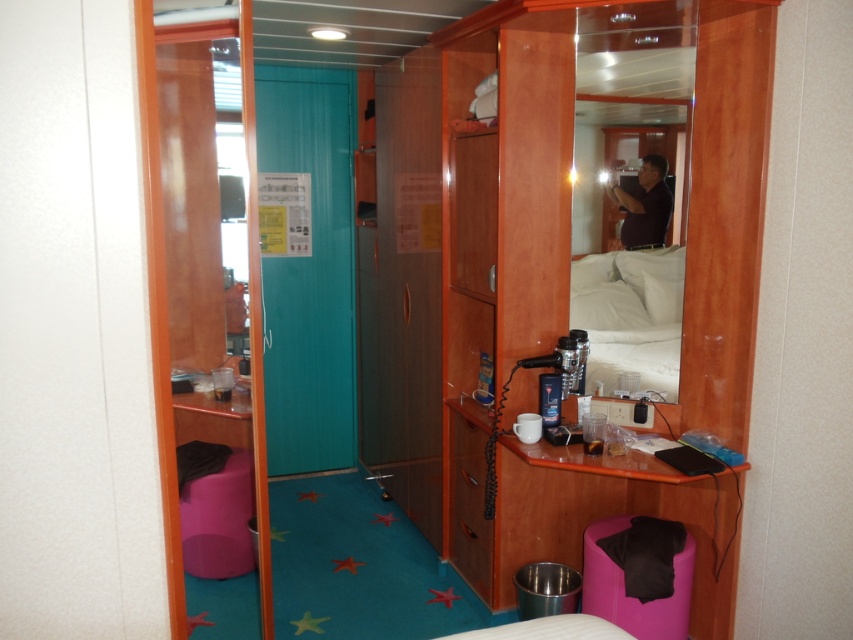
You are a guest in this cruise ship cabin and need to place a rectangular luggage box that is 1.2 meters wide on the floor. The wooden cabinet at center and the white soft bed at center are both in the center of the room. Which object should you place the luggage next to so that it fits without overlapping?

The wooden cabinet at center has a larger width than the white soft bed at center. Since the luggage is 1.2 meters wide, placing it next to the wooden cabinet at center would provide more space to accommodate the luggage without overlapping.

You are standing in the cruise ship cabin and want to reach both the point at coordinates (701, 353) and the point at coordinates (628, 276). Which point will you physically touch first if you extend your hand forward?

The point at coordinates (701, 353) is closer to the camera than the point at coordinates (628, 276), so you will touch the point at coordinates (701, 353) first.

From the picture: You are a traveler who just arrived at your cruise cabin. You want to place a rectangular luggage box that is 2 feet wide on the floor between the white soft bed at center and the purple fabric stool at lower right. Can the luggage box fit there without overlapping either object?

The white soft bed at center is wider than the purple fabric stool at lower right. Since the luggage box is 2 feet wide, it can fit between them as long as the space between the two objects is at least 2 feet wide. However, the exact width of the space isn not provided, so we cannot confirm without more information.